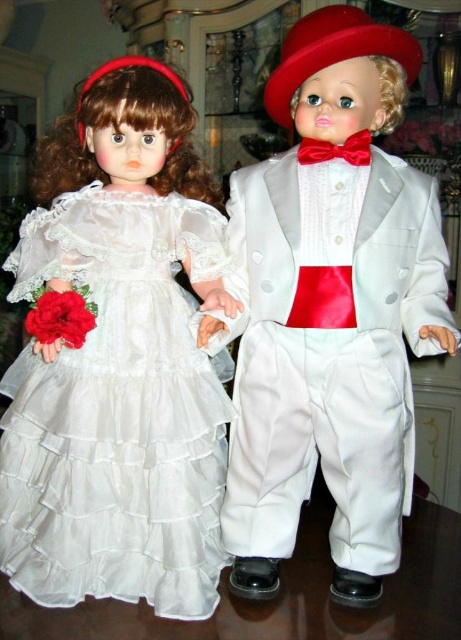
In the scene shown: You are a photographer standing 30 inches away from the image. You want to focus on the point at coordinates point (323,305). Will you need to adjust your focus to capture this point clearly?

The distance of point (323,305) from viewer is 23.80 inches. Since you are standing 30 inches away, you will need to adjust your focus closer to capture the point clearly.

You are a photographer setting up a camera to capture the two points in the image. Which point, point (379,35) or point (212,376), is closer to the camera?

Point (379,35) is closer to the viewer than point (212,376), so it is closer to the camera.

You are a photographer setting up for a formal event. You need to position a spotlight so that it illuminates the satin white suit at center without casting a shadow on the white satin dress at left. Given their current positions, is this possible?

The satin white suit at center is in front of the white satin dress at left. Since the suit is in front, positioning the spotlight appropriately behind or to the side could illuminate the suit while avoiding the dress, so yes, it is possible.